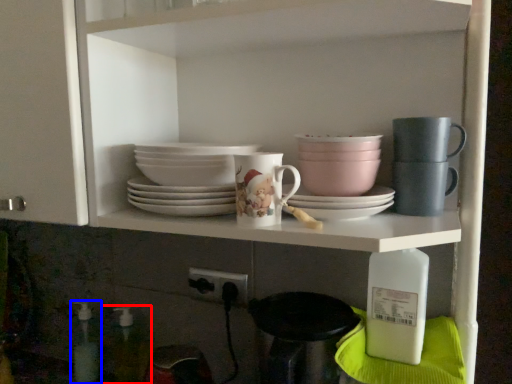
Question: Which point is further to the camera, bottle (highlighted by a red box) or bottle (highlighted by a blue box)?

Choices:
 (A) bottle
 (B) bottle

Answer: (B)